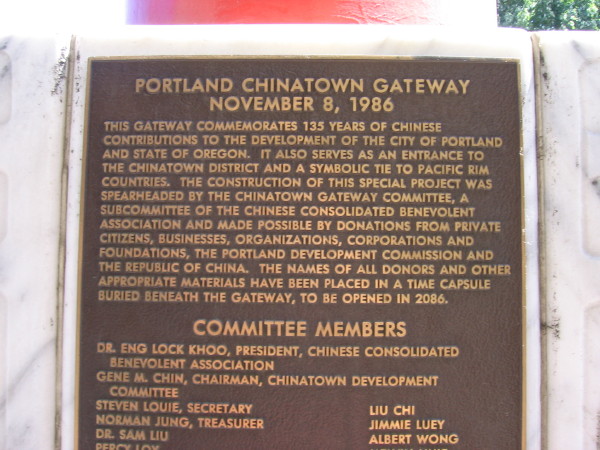
Locate an element on the screen. The height and width of the screenshot is (450, 600). orange pillar is located at coordinates (283, 13).